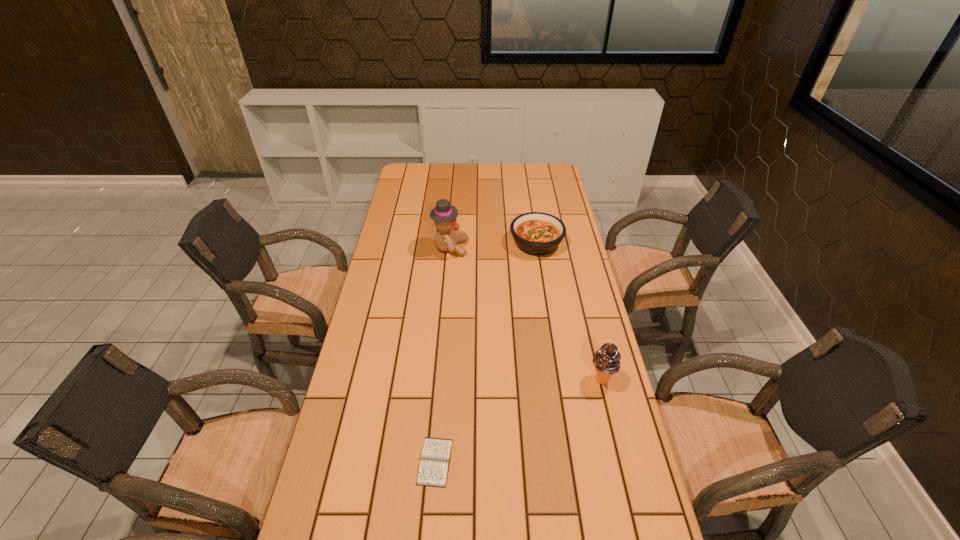
I want to click on free space that satisfies the following two spatial constraints: 1. on the front side of the third tallest object; 2. on the front-facing side of the tallest object, so click(x=538, y=248).

You are a GUI agent. You are given a task and a screenshot of the screen. Output one action in this format:
    pyautogui.click(x=<x>, y=<y>)
    Task: Click on the vacant space that satisfies the following two spatial constraints: 1. on the front-facing side of the shortest object; 2. on the right side of the tallest object
    This screenshot has height=540, width=960.
    Given the screenshot: What is the action you would take?
    pyautogui.click(x=433, y=462)

Identify the location of free location that satisfies the following two spatial constraints: 1. on the front-facing side of the rag_doll; 2. on the back side of the third shortest object. (440, 380).

This screenshot has height=540, width=960. In order to click on vacant region that satisfies the following two spatial constraints: 1. on the back side of the diary; 2. on the right side of the stew in this screenshot , I will do `click(452, 243)`.

Where is `free space that satisfies the following two spatial constraints: 1. on the back side of the shortest object; 2. on the front-facing side of the rag_doll`? free space that satisfies the following two spatial constraints: 1. on the back side of the shortest object; 2. on the front-facing side of the rag_doll is located at coordinates (451, 248).

Locate an element on the screen. This screenshot has width=960, height=540. vacant area that satisfies the following two spatial constraints: 1. on the front-facing side of the rag_doll; 2. on the back side of the third farthest object is located at coordinates (440, 380).